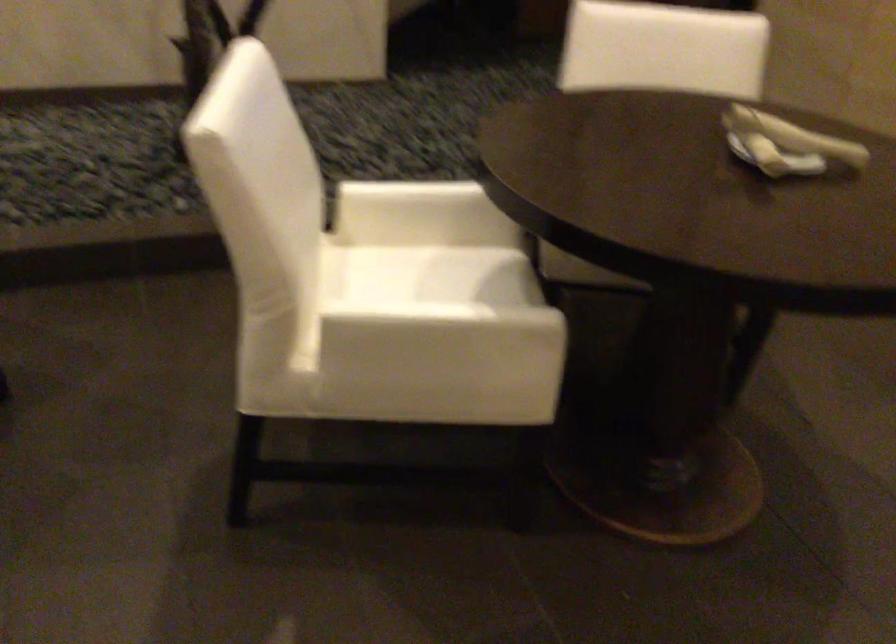
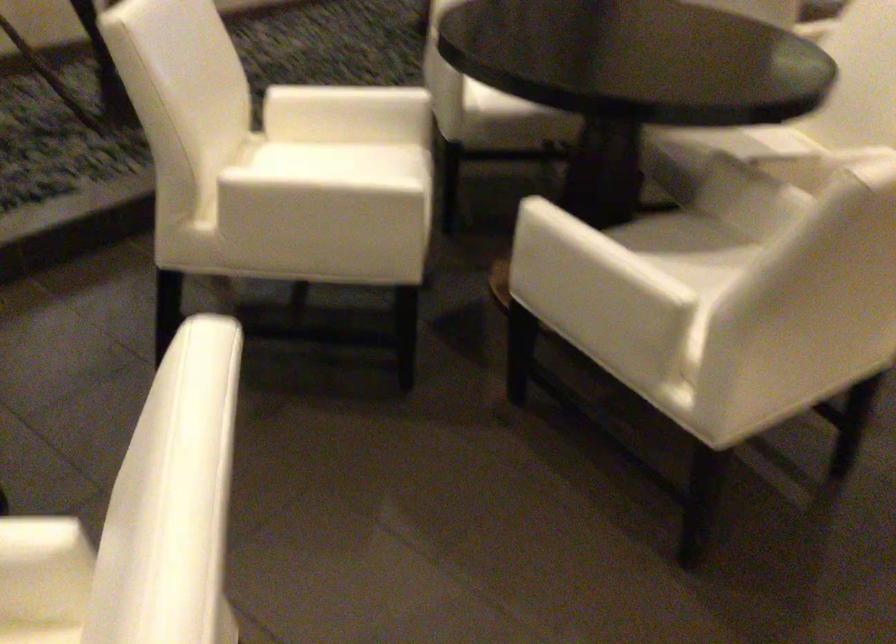
What movement of the cameraman would produce the second image?

The cameraman moved toward left, backward.